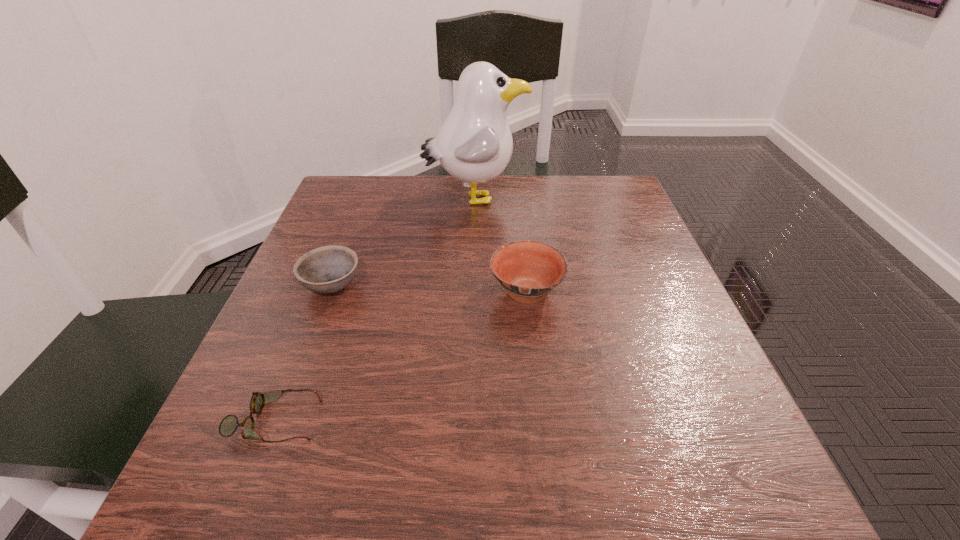
The image size is (960, 540). What are the coordinates of `vacant space located 0.210m on the back of the left bowl` in the screenshot? It's located at (360, 212).

This screenshot has width=960, height=540. What are the coordinates of `free location located on the front-facing side of the shortest object` in the screenshot? It's located at (433, 421).

You are a GUI agent. You are given a task and a screenshot of the screen. Output one action in this format:
    pyautogui.click(x=<x>, y=<y>)
    Task: Click on the object at the far edge
    This screenshot has height=540, width=960.
    Given the screenshot: What is the action you would take?
    pyautogui.click(x=474, y=145)

Where is `bowl situated at the left edge`? The image size is (960, 540). bowl situated at the left edge is located at coordinates (328, 269).

Find the location of a particular element. This screenshot has width=960, height=540. spectacles that is at the left edge is located at coordinates (228, 426).

In the image, there is a desktop. Identify the location of vacant space at the far edge. (428, 203).

The image size is (960, 540). Find the location of `vacant space at the near edge`. vacant space at the near edge is located at coordinates (511, 500).

Identify the location of vacant area at the left edge. The width and height of the screenshot is (960, 540). pos(372,230).

Locate an element on the screen. This screenshot has height=540, width=960. free space at the right edge of the desktop is located at coordinates (642, 304).

The height and width of the screenshot is (540, 960). I want to click on free space at the far left corner of the desktop, so click(341, 211).